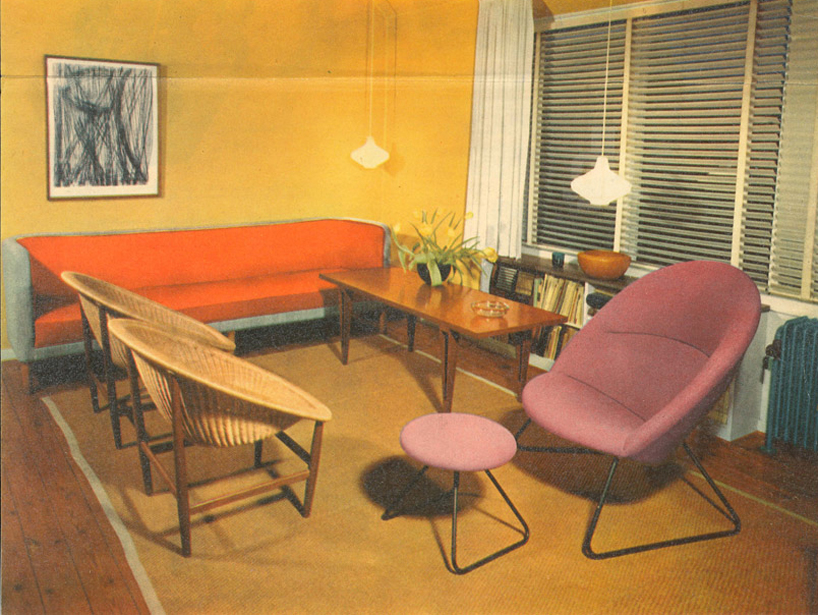
The image size is (818, 615). Identify the location of wall art. (101, 157).